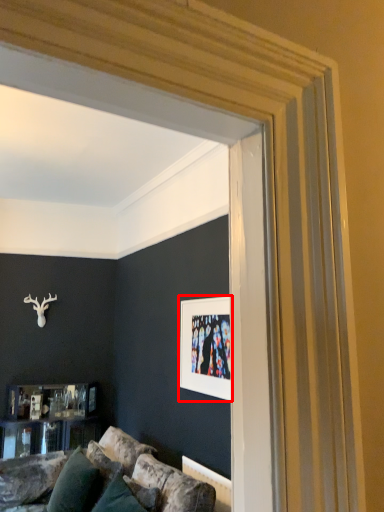
Question: From the image's perspective, what is the correct spatial relationship of picture frame (annotated by the red box) in relation to pillow?

Choices:
 (A) above
 (B) below

Answer: (A)